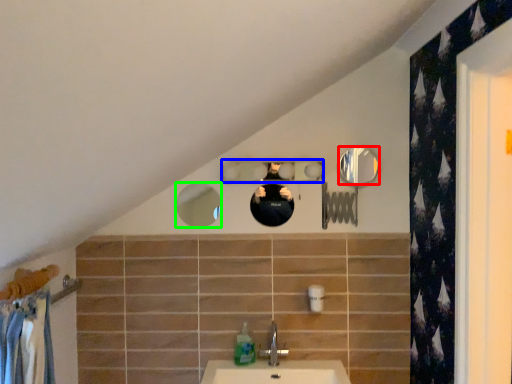
Question: Which object is positioned closest to mirror (highlighted by a red box)? Select from mirror (highlighted by a blue box) and mirror (highlighted by a green box).

Choices:
 (A) mirror
 (B) mirror

Answer: (A)